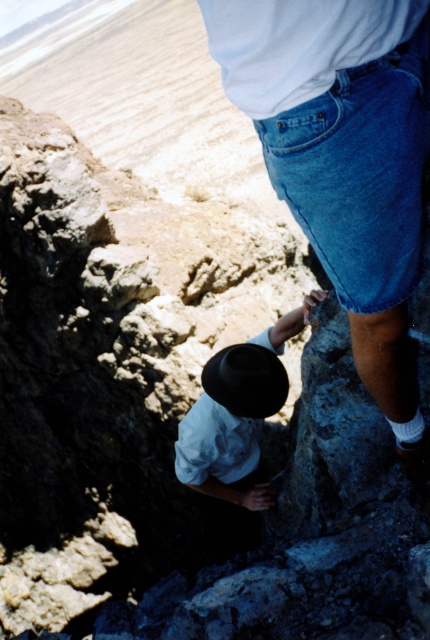
You are a photographer trying to capture a closeup of the denim shorts at center and the white cotton shirt at center. Which one will appear larger in your photo?

The denim shorts at center will appear larger in the photo because it is closer to the viewer than the white cotton shirt at center.

Where is the denim shorts at center located in the image?

The denim shorts at center is located at point coordinates of [359,172].